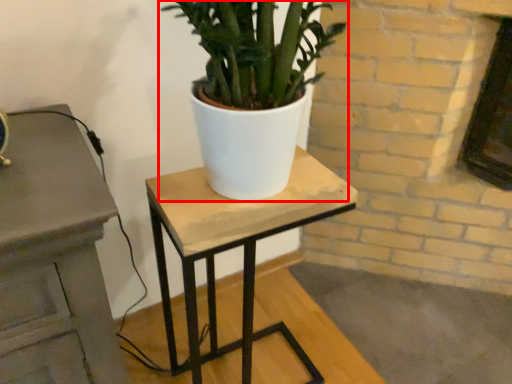
Question: From the image's perspective, considering the relative positions of houseplant (annotated by the red box) and table in the image provided, where is houseplant (annotated by the red box) located with respect to the staircase?

Choices:
 (A) below
 (B) above

Answer: (B)